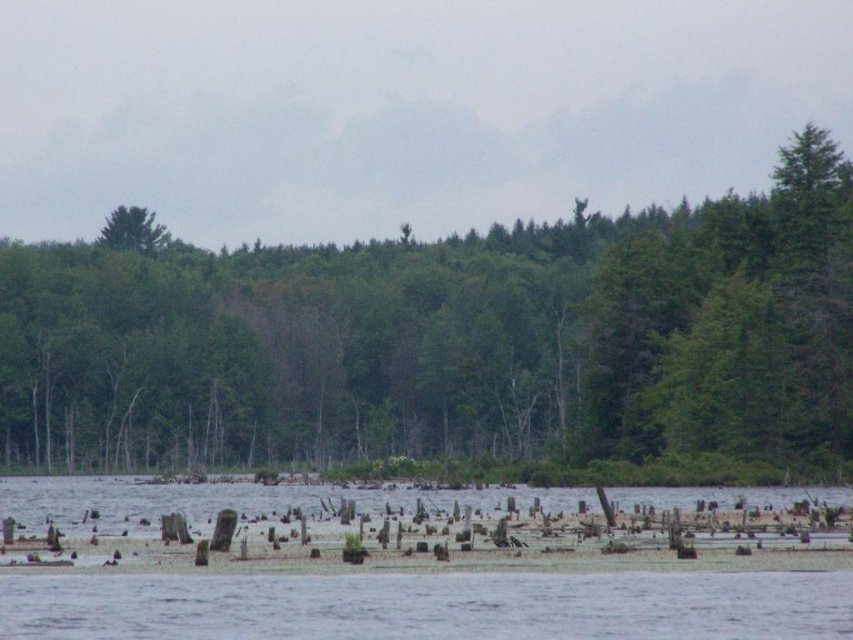
You are standing at the edge of the lake and see the transparent water at lower center and the green matte tree at upper left. Which object appears taller from your viewpoint?

The green matte tree at upper left appears taller than the transparent water at lower center because the transparent water at lower center has a lesser height compared to green matte tree at upper left.

You are standing at the edge of the water and see two trees in the distance. Which one is positioned to the right of the other? The trees are labeled as green matte tree at center and green matte tree at upper left. Please specify which one is on the right side.

The green matte tree at center is positioned to the right of the green matte tree at upper left.

You are standing at the edge of the lake and see the green matte tree at center and the green matte tree at upper left. Which tree is closer to you?

The green matte tree at center is closer to you because it is in front of the green matte tree at upper left, indicating it is nearer in the scene.